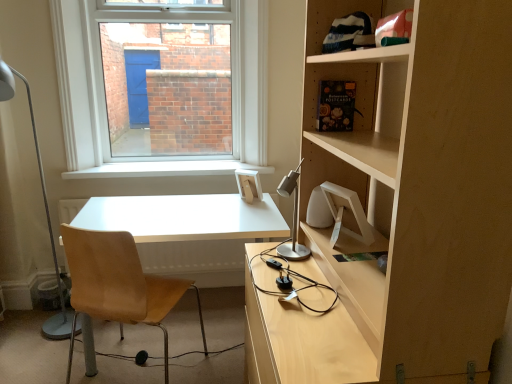
This screenshot has height=384, width=512. Identify the location of vacant space in white metal table lamp at left, marked as the first table lamp in a left-to-right arrangement (from a real-world perspective). (44, 354).